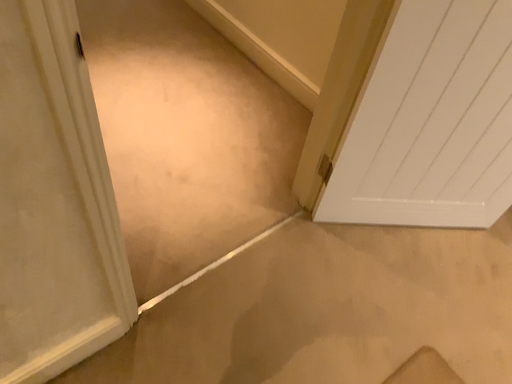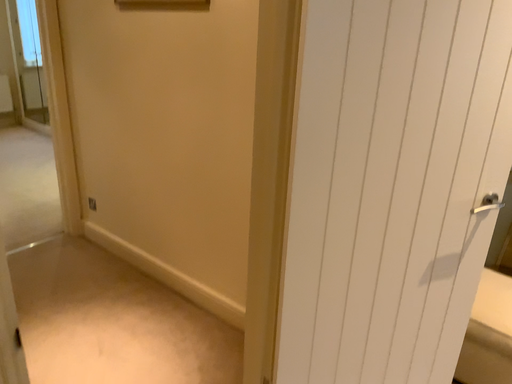
Question: How did the camera likely rotate when shooting the video?

Choices:
 (A) rotated upward
 (B) rotated downward

Answer: (A)